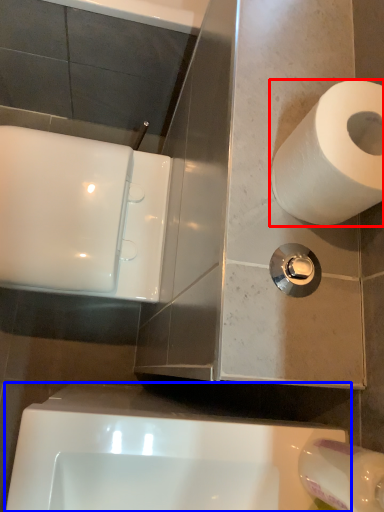
Question: Which point is closer to the camera, toilet paper (highlighted by a red box) or bath (highlighted by a blue box)?

Choices:
 (A) toilet paper
 (B) bath

Answer: (A)